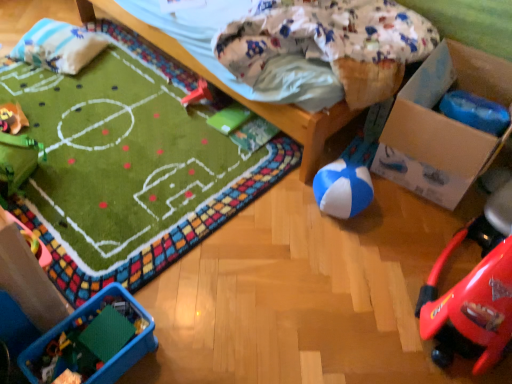
What do you see at coordinates (442, 126) in the screenshot?
I see `cardboard box at lower right` at bounding box center [442, 126].

You are a GUI agent. You are given a task and a screenshot of the screen. Output one action in this format:
    pyautogui.click(x=<x>, y=<y>)
    Task: Click on the cardboard box at lower right
    
    Given the screenshot: What is the action you would take?
    pyautogui.click(x=442, y=126)

Could you tell me if white soft pillow at upper left is turned towards cardboard box at lower right?

No, white soft pillow at upper left is not aimed at cardboard box at lower right.

Looking at this image, from a real-world perspective, is white soft pillow at upper left on top of cardboard box at lower right?

Incorrect, from a real-world perspective, white soft pillow at upper left is lower than cardboard box at lower right.

Is cardboard box at lower right inside white soft pillow at upper left?

No, cardboard box at lower right is not inside white soft pillow at upper left.

From the image's perspective, between white soft pillow at upper left and cardboard box at lower right, who is located below?

cardboard box at lower right, from the image's perspective.

Can you confirm if blue/white rubber ball at center-right, the third toy from the back, is taller than plush yellow duck at upper left, acting as the 3th toy starting from the bottom?

Yes, blue/white rubber ball at center-right, the third toy from the back, is taller than plush yellow duck at upper left, acting as the 3th toy starting from the bottom.

Is blue/white rubber ball at center-right, the fourth toy from the left, facing towards plush yellow duck at upper left, marked as the 2th toy in a back-to-front arrangement?

No, blue/white rubber ball at center-right, the fourth toy from the left, does not turn towards plush yellow duck at upper left, marked as the 2th toy in a back-to-front arrangement.

From the image's perspective, count 1st toys downward from the plush yellow duck at upper left, acting as the 3th toy starting from the bottom, and point to it. Please provide its 2D coordinates.

[(346, 181)]

Measure the distance between blue/white rubber ball at center-right, the third toy from the back, and plush yellow duck at upper left, which is counted as the fourth toy, starting from the right.

A distance of 1.52 meters exists between blue/white rubber ball at center-right, the third toy from the back, and plush yellow duck at upper left, which is counted as the fourth toy, starting from the right.

Can you confirm if translucent plastic container at lower left, which is the 3th toy from right to left, is wider than plush yellow duck at upper left, which is counted as the fourth toy, starting from the right?

Indeed, translucent plastic container at lower left, which is the 3th toy from right to left, has a greater width compared to plush yellow duck at upper left, which is counted as the fourth toy, starting from the right.

Is translucent plastic container at lower left, the fourth toy viewed from the back, inside or outside of plush yellow duck at upper left, which is the first toy in left-to-right order?

translucent plastic container at lower left, the fourth toy viewed from the back, is located beyond the bounds of plush yellow duck at upper left, which is the first toy in left-to-right order.

Is translucent plastic container at lower left, placed as the first toy when sorted from front to back, positioned in front of plush yellow duck at upper left, which is counted as the fourth toy, starting from the right?

Yes, it is.

How different are the orientations of translucent plastic container at lower left, which is counted as the fourth toy, starting from the top, and plush yellow duck at upper left, which is the first toy in left-to-right order, in degrees?

4.08 degrees separate the facing orientations of translucent plastic container at lower left, which is counted as the fourth toy, starting from the top, and plush yellow duck at upper left, which is the first toy in left-to-right order.

From a real-world perspective, is white soft pillow at upper left positioned under blue/white rubber ball at center-right, which ranks as the 3th toy in top-to-bottom order, based on gravity?

Yes, from a real-world perspective, white soft pillow at upper left is beneath blue/white rubber ball at center-right, which ranks as the 3th toy in top-to-bottom order.

Is white soft pillow at upper left smaller than blue/white rubber ball at center-right, which ranks as the 3th toy in top-to-bottom order?

No, white soft pillow at upper left is not smaller than blue/white rubber ball at center-right, which ranks as the 3th toy in top-to-bottom order.

Is white soft pillow at upper left outside of blue/white rubber ball at center-right, the fourth toy from the left?

Yes, white soft pillow at upper left is outside of blue/white rubber ball at center-right, the fourth toy from the left.

Is point (27, 32) closer or farther from the camera than point (350, 209)?

Point (27, 32) appears to be farther away from the viewer than point (350, 209).

From a real-world perspective, who is located higher, wooden bed frame at upper center or white soft pillow at upper left?

From a 3D spatial view, wooden bed frame at upper center is above.

In terms of height, does wooden bed frame at upper center look taller or shorter compared to white soft pillow at upper left?

In the image, wooden bed frame at upper center appears to be taller than white soft pillow at upper left.

How different are the orientations of wooden bed frame at upper center and white soft pillow at upper left in degrees?

22.6 degrees.

Measure the distance between wooden bed frame at upper center and white soft pillow at upper left.

wooden bed frame at upper center is 18.58 inches away from white soft pillow at upper left.

From a real-world perspective, is blue/white rubber ball at center-right, which is the 2th toy from bottom to top, below rubberized red car at center, marked as the 4th toy in a bottom-to-top arrangement?

Incorrect, from a real-world perspective, blue/white rubber ball at center-right, which is the 2th toy from bottom to top, is higher than rubberized red car at center, marked as the 4th toy in a bottom-to-top arrangement.

Which of these two, blue/white rubber ball at center-right, which is the 2th toy from bottom to top, or rubberized red car at center, arranged as the first toy when viewed from the back, is thinner?

With smaller width is rubberized red car at center, arranged as the first toy when viewed from the back.

Is blue/white rubber ball at center-right, the third toy from the back, with rubberized red car at center, placed as the fourth toy when sorted from front to back?

blue/white rubber ball at center-right, the third toy from the back, and rubberized red car at center, placed as the fourth toy when sorted from front to back, are not in contact.

Considering the relative positions of blue/white rubber ball at center-right, which is the 2th toy from bottom to top, and rubberized red car at center, placed as the fourth toy when sorted from front to back, in the image provided, is blue/white rubber ball at center-right, which is the 2th toy from bottom to top, to the left of rubberized red car at center, placed as the fourth toy when sorted from front to back, from the viewer's perspective?

In fact, blue/white rubber ball at center-right, which is the 2th toy from bottom to top, is to the right of rubberized red car at center, placed as the fourth toy when sorted from front to back.

Is cardboard box at lower right aimed at plush yellow duck at upper left, which is counted as the fourth toy, starting from the right?

No.

Considering the sizes of objects cardboard box at lower right and plush yellow duck at upper left, acting as the 3th toy starting from the bottom, in the image provided, who is wider, cardboard box at lower right or plush yellow duck at upper left, acting as the 3th toy starting from the bottom,?

cardboard box at lower right.

From the image's perspective, is cardboard box at lower right positioned above or below plush yellow duck at upper left, which is counted as the third toy, starting from the front?

cardboard box at lower right is below plush yellow duck at upper left, which is counted as the third toy, starting from the front.

The image size is (512, 384). I want to click on toy that is the 4th object directly below the cardboard box at lower right (from a real-world perspective), so (x=13, y=117).

The height and width of the screenshot is (384, 512). In order to click on cardboard box lying in front of the white soft pillow at upper left in this screenshot , I will do `click(442, 126)`.

There is a plush yellow duck at upper left, positioned as the 2th toy in top-to-bottom order. Where is `the 1st toy below it (from the image's perspective)`? The width and height of the screenshot is (512, 384). the 1st toy below it (from the image's perspective) is located at coordinates (346, 181).

From the image, which object appears to be nearer to blue/white rubber ball at center-right, the third toy from the back, wooden bed frame at upper center or cardboard box at lower right?

The object closer to blue/white rubber ball at center-right, the third toy from the back, is cardboard box at lower right.

Which object lies nearer to the anchor point rubberized red car at center, which ranks as the first toy in top-to-bottom order, white soft pillow at upper left or wooden bed frame at upper center?

wooden bed frame at upper center is closer to rubberized red car at center, which ranks as the first toy in top-to-bottom order.

Looking at the image, which one is located further to translucent plastic container at lower left, which is the 3th toy from right to left, cardboard box at lower right or rubberized red car at center, placed as the fourth toy when sorted from front to back?

The object further to translucent plastic container at lower left, which is the 3th toy from right to left, is cardboard box at lower right.

From the image, which object appears to be farther from rubberized red car at center, arranged as the first toy when viewed from the back, cardboard box at lower right or white soft pillow at upper left?

cardboard box at lower right is positioned further to the anchor rubberized red car at center, arranged as the first toy when viewed from the back.

Looking at the image, which one is located further to cardboard box at lower right, wooden bed frame at upper center or plush yellow duck at upper left, positioned as the 2th toy in top-to-bottom order?

The object further to cardboard box at lower right is plush yellow duck at upper left, positioned as the 2th toy in top-to-bottom order.

Which object lies nearer to the anchor point translucent plastic container at lower left, which is the 3th toy from right to left, white soft pillow at upper left or rubberized red car at center, acting as the 3th toy starting from the left?

A: Based on the image, rubberized red car at center, acting as the 3th toy starting from the left, appears to be nearer to translucent plastic container at lower left, which is the 3th toy from right to left.

When comparing their distances from translucent plastic container at lower left, which is the 3th toy from right to left, does blue/white rubber ball at center-right, the second toy viewed from the front, or wooden bed frame at upper center seem closer?

Based on the image, blue/white rubber ball at center-right, the second toy viewed from the front, appears to be nearer to translucent plastic container at lower left, which is the 3th toy from right to left.

Looking at the image, which one is located further to plush yellow duck at upper left, which is counted as the fourth toy, starting from the right, cardboard box at lower right or translucent plastic container at lower left, positioned as the 1th toy in bottom-to-top order?

Among the two, cardboard box at lower right is located further to plush yellow duck at upper left, which is counted as the fourth toy, starting from the right.

Where is `pillow situated between plush yellow duck at upper left, which is the first toy in left-to-right order, and cardboard box at lower right from left to right`? The height and width of the screenshot is (384, 512). pillow situated between plush yellow duck at upper left, which is the first toy in left-to-right order, and cardboard box at lower right from left to right is located at coordinates (58, 46).

You are a GUI agent. You are given a task and a screenshot of the screen. Output one action in this format:
    pyautogui.click(x=<x>, y=<y>)
    Task: Click on the cardboard box between wooden bed frame at upper center and translucent plastic container at lower left, positioned as the 1th toy in bottom-to-top order, in the vertical direction
    The image size is (512, 384).
    Given the screenshot: What is the action you would take?
    pyautogui.click(x=442, y=126)

The width and height of the screenshot is (512, 384). I want to click on toy between rubberized red car at center, which ranks as the first toy in top-to-bottom order, and cardboard box at lower right, in the horizontal direction, so click(346, 181).

Locate an element on the screen. This screenshot has height=384, width=512. furniture located between white soft pillow at upper left and blue/white rubber ball at center-right, the fourth toy from the left, in the left-right direction is located at coordinates (238, 93).